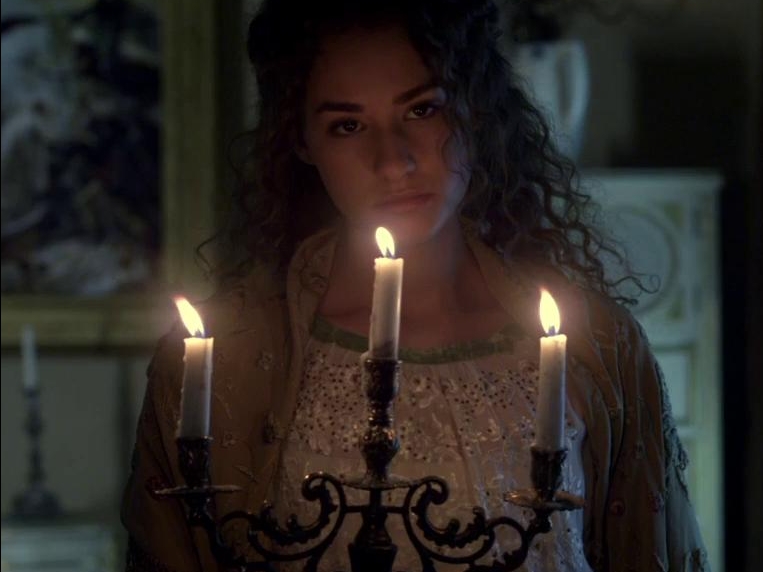
Where is `wall`? The width and height of the screenshot is (763, 572). wall is located at coordinates click(x=101, y=407).